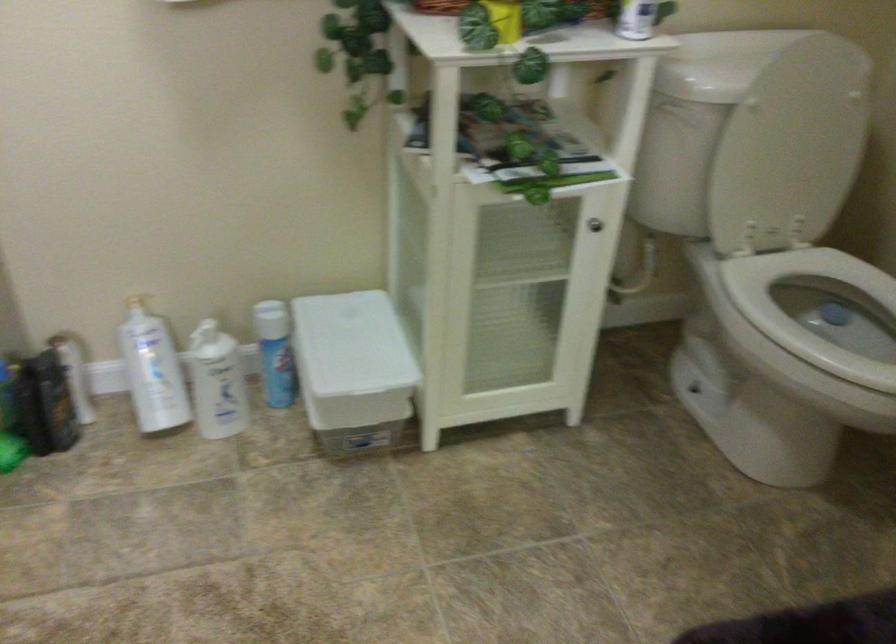
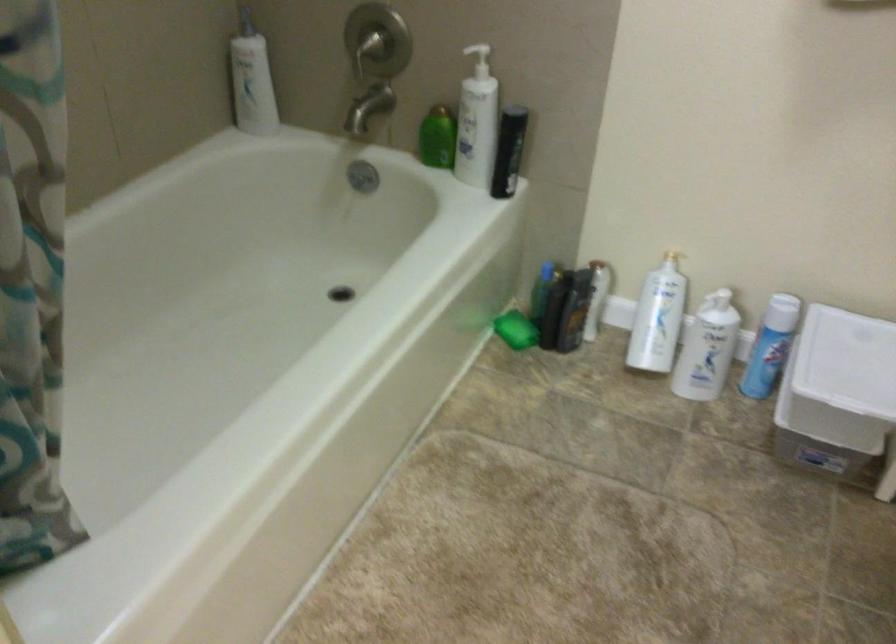
Question: The first image is from the beginning of the video and the second image is from the end. How did the camera likely rotate when shooting the video?

Choices:
 (A) Left
 (B) Right
 (C) Up
 (D) Down

Answer: (A)